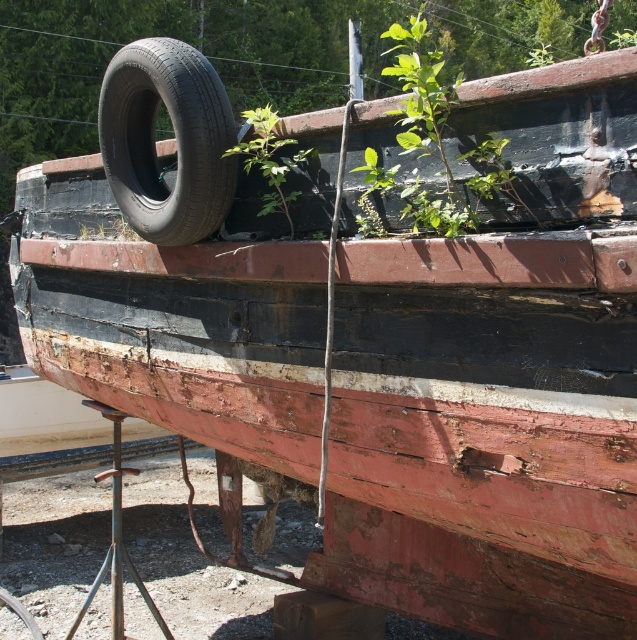
Question: Can you confirm if black rubber tire at upper left is positioned above green leafy plant at upper center?

Choices:
 (A) yes
 (B) no

Answer: (B)

Question: Based on their relative distances, which object is nearer to the green leafy plant at center?

Choices:
 (A) green leafy plant at upper center
 (B) black rubber tire at upper left

Answer: (B)

Question: Which point is closer to the camera?

Choices:
 (A) (424, 211)
 (B) (269, 204)
 (C) (220, 177)

Answer: (A)

Question: Observing the image, what is the correct spatial positioning of black rubber tire at upper left in reference to green leafy plant at center?

Choices:
 (A) below
 (B) above

Answer: (A)

Question: Which object appears closest to the camera in this image?

Choices:
 (A) green leafy plant at center
 (B) black rubber tire at upper left

Answer: (B)

Question: Can you confirm if green leafy plant at upper center is thinner than green leafy plant at center?

Choices:
 (A) no
 (B) yes

Answer: (A)